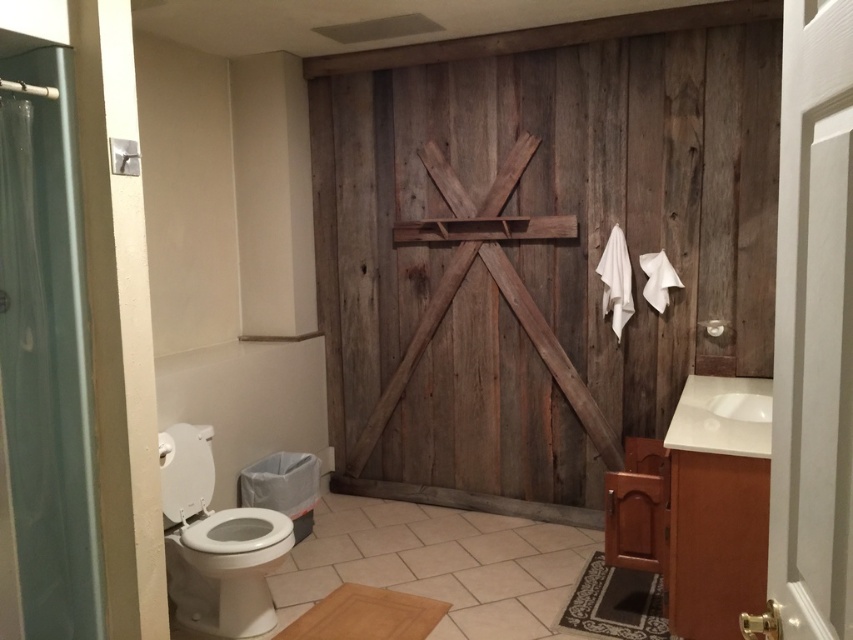
Does weathered wood barn door at center have a smaller size compared to white glossy toilet bowl at lower left?

No, weathered wood barn door at center is not smaller than white glossy toilet bowl at lower left.

Is point (695, 116) farther from viewer compared to point (224, 592)?

That is True.

Image resolution: width=853 pixels, height=640 pixels. In order to click on weathered wood barn door at center in this screenshot , I will do `click(538, 246)`.

Does weathered wood barn door at center have a lesser width compared to clear plastic shower curtain at left?

No, weathered wood barn door at center is not thinner than clear plastic shower curtain at left.

Between point (457, 396) and point (47, 378), which one is positioned in front?

Point (47, 378) is more forward.

Who is more forward, (764, 273) or (93, 488)?

Point (93, 488)

Find the location of a particular element. This screenshot has width=853, height=640. weathered wood barn door at center is located at coordinates (538, 246).

Between weathered wood barn door at center and white glossy sink at right, which one is positioned higher?

weathered wood barn door at center

In the scene shown: Can you confirm if weathered wood barn door at center is thinner than white glossy sink at right?

No.

At what (x,y) coordinates should I click in order to perform the action: click on weathered wood barn door at center. Please return your answer as a coordinate pair (x, y). Looking at the image, I should click on (538, 246).